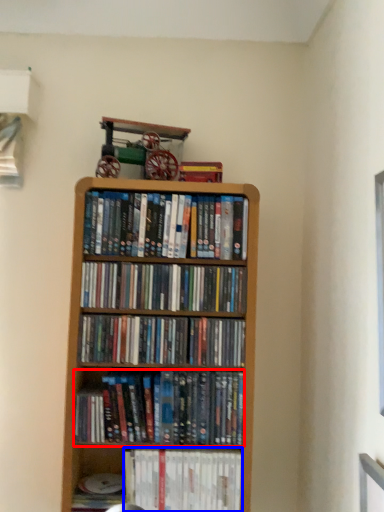
Question: Which point is further to the camera, book (highlighted by a red box) or book (highlighted by a blue box)?

Choices:
 (A) book
 (B) book

Answer: (B)